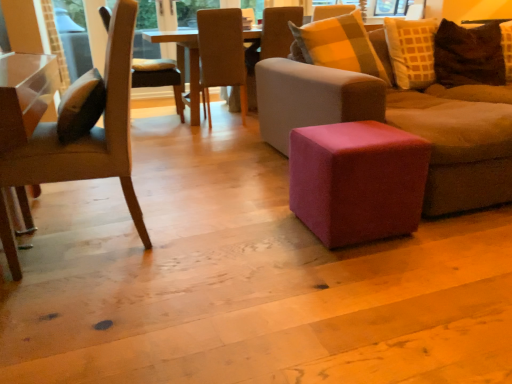
Locate an element on the screen. The height and width of the screenshot is (384, 512). vacant space to the left of pink fabric stool at center is located at coordinates (263, 231).